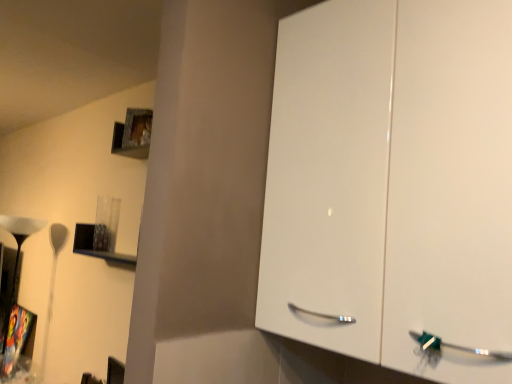
Describe the element at coordinates (93, 246) in the screenshot. I see `metallic silver shelf at upper left` at that location.

Locate an element on the screen. Image resolution: width=512 pixels, height=384 pixels. metallic silver shelf at upper left is located at coordinates (93, 246).

The height and width of the screenshot is (384, 512). Describe the element at coordinates (19, 241) in the screenshot. I see `matte black lampshade at left` at that location.

Locate an element on the screen. The width and height of the screenshot is (512, 384). matte black lampshade at left is located at coordinates (19, 241).

I want to click on metallic silver shelf at upper left, so click(93, 246).

Considering the relative positions of matte black lampshade at left and metallic silver shelf at upper left in the image provided, is matte black lampshade at left to the left or to the right of metallic silver shelf at upper left?

matte black lampshade at left is to the left of metallic silver shelf at upper left.

Considering the relative positions of matte black lampshade at left and metallic silver shelf at upper left in the image provided, is matte black lampshade at left behind metallic silver shelf at upper left?

Yes, it is behind metallic silver shelf at upper left.

Is point (27, 234) farther from camera compared to point (112, 255)?

Yes, it is behind point (112, 255).

From the image's perspective, is matte black lampshade at left located above or below metallic silver shelf at upper left?

From the image's perspective, matte black lampshade at left appears below metallic silver shelf at upper left.

From a real-world perspective, which is physically above, matte black lampshade at left or metallic silver shelf at upper left?

metallic silver shelf at upper left, from a real-world perspective.

Which of these two, matte black lampshade at left or metallic silver shelf at upper left, is wider?

Wider between the two is matte black lampshade at left.

Which of these two, matte black lampshade at left or metallic silver shelf at upper left, stands shorter?

metallic silver shelf at upper left.

Considering the sizes of objects matte black lampshade at left and metallic silver shelf at upper left in the image provided, who is smaller, matte black lampshade at left or metallic silver shelf at upper left?

metallic silver shelf at upper left is smaller.

Which is correct: matte black lampshade at left is inside metallic silver shelf at upper left, or outside of it?

matte black lampshade at left is located beyond the bounds of metallic silver shelf at upper left.

Is matte black lampshade at left next to metallic silver shelf at upper left?

No, matte black lampshade at left is not in contact with metallic silver shelf at upper left.

Is matte black lampshade at left positioned with its back to metallic silver shelf at upper left?

No, metallic silver shelf at upper left is not at the back of matte black lampshade at left.

How distant is matte black lampshade at left from metallic silver shelf at upper left?

matte black lampshade at left and metallic silver shelf at upper left are 24.90 inches apart.

What are the coordinates of `lamp lying below the metallic silver shelf at upper left (from the image's perspective)` in the screenshot? It's located at (19, 241).

In the image, is metallic silver shelf at upper left on the left side or the right side of matte black lampshade at left?

From the image, it's evident that metallic silver shelf at upper left is to the right of matte black lampshade at left.

Looking at this image, is metallic silver shelf at upper left in front of or behind matte black lampshade at left in the image?

metallic silver shelf at upper left is in front of matte black lampshade at left.

Which is in front, point (131, 256) or point (15, 283)?

The point (131, 256) is more forward.

From the image's perspective, is metallic silver shelf at upper left above or below matte black lampshade at left?

From the image's perspective, metallic silver shelf at upper left appears above matte black lampshade at left.

From a real-world perspective, is metallic silver shelf at upper left under matte black lampshade at left?

No, from a real-world perspective, metallic silver shelf at upper left is not beneath matte black lampshade at left.

In the scene shown: Does metallic silver shelf at upper left have a greater width compared to matte black lampshade at left?

In fact, metallic silver shelf at upper left might be narrower than matte black lampshade at left.

Who is shorter, metallic silver shelf at upper left or matte black lampshade at left?

metallic silver shelf at upper left is shorter.

Consider the image. Who is bigger, metallic silver shelf at upper left or matte black lampshade at left?

matte black lampshade at left.

Is metallic silver shelf at upper left inside or outside of matte black lampshade at left?

metallic silver shelf at upper left is not enclosed by matte black lampshade at left.

Is the surface of metallic silver shelf at upper left in direct contact with matte black lampshade at left?

No, metallic silver shelf at upper left is not touching matte black lampshade at left.

Is metallic silver shelf at upper left positioned with its back to matte black lampshade at left?

metallic silver shelf at upper left is not turned away from matte black lampshade at left.

Locate an element on the screen. shelf located above the matte black lampshade at left (from the image's perspective) is located at coordinates (93, 246).

You are a GUI agent. You are given a task and a screenshot of the screen. Output one action in this format:
    pyautogui.click(x=<x>, y=<y>)
    Task: Click on the lamp that appears below the metallic silver shelf at upper left (from a real-world perspective)
    This screenshot has height=384, width=512.
    Given the screenshot: What is the action you would take?
    pyautogui.click(x=19, y=241)

Where is `shelf located in front of the matte black lampshade at left`? shelf located in front of the matte black lampshade at left is located at coordinates (93, 246).